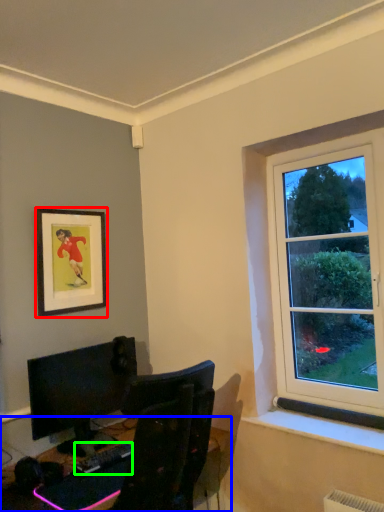
Question: Based on their relative distances, which object is farther from picture frame (highlighted by a red box)? Choose from desk (highlighted by a blue box) and computer keyboard (highlighted by a green box).

Choices:
 (A) desk
 (B) computer keyboard

Answer: (B)